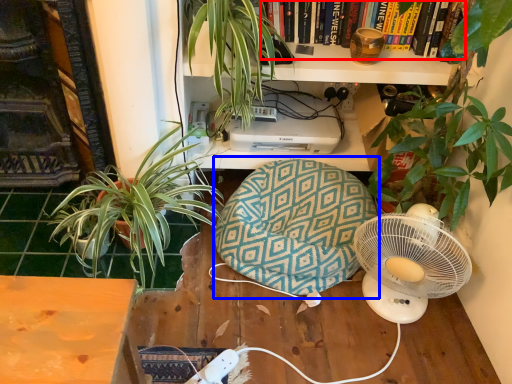
Question: Among these objects, which one is farthest to the camera, book (highlighted by a red box) or bean bag chair (highlighted by a blue box)?

Choices:
 (A) book
 (B) bean bag chair

Answer: (A)